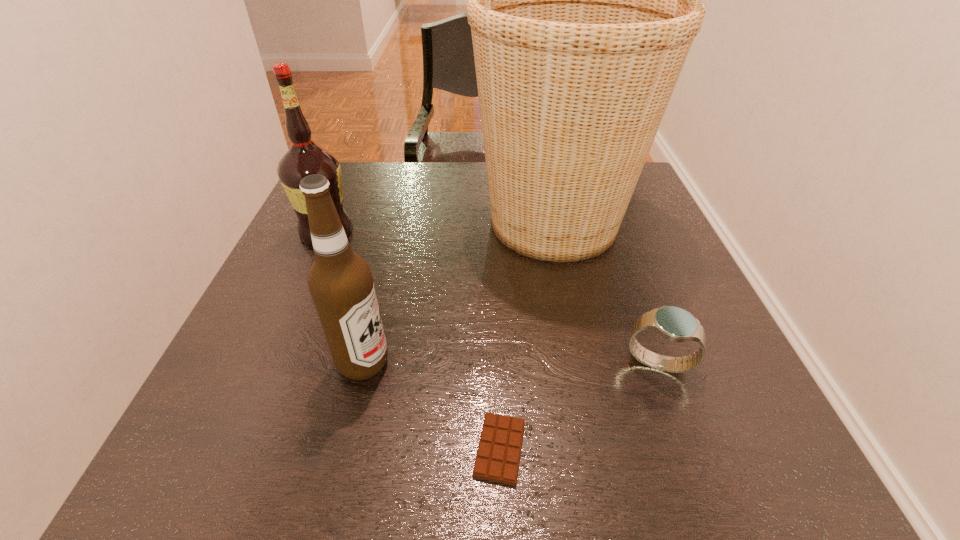
I want to click on vacant space at the near edge of the desktop, so click(360, 446).

You are a GUI agent. You are given a task and a screenshot of the screen. Output one action in this format:
    pyautogui.click(x=<x>, y=<y>)
    Task: Click on the vacant space at the left edge of the desktop
    The height and width of the screenshot is (540, 960).
    Given the screenshot: What is the action you would take?
    pyautogui.click(x=216, y=380)

Identify the location of free spot at the right edge of the desktop. The image size is (960, 540). (670, 347).

Where is `free point between the watch and the leftmost object`? Image resolution: width=960 pixels, height=540 pixels. free point between the watch and the leftmost object is located at coordinates (492, 298).

Find the location of a particular element. free space between the basket and the leftmost object is located at coordinates (440, 227).

The width and height of the screenshot is (960, 540). I want to click on free space that is in between the watch and the candy bar, so click(x=579, y=406).

Find the location of a particular element. free space between the second shortest object and the farther alcohol is located at coordinates (492, 298).

Identify the location of free space between the left alcohol and the watch. Image resolution: width=960 pixels, height=540 pixels. (492, 298).

Identify the location of empty location between the basket and the candy bar. (527, 335).

Where is `vacant region between the candy bar and the basket`? This screenshot has height=540, width=960. vacant region between the candy bar and the basket is located at coordinates click(x=527, y=335).